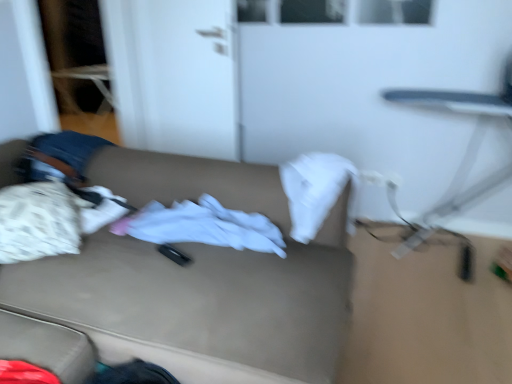
Locate an element on the screen. The image size is (512, 384). vacant area situated below metallic silver swivel chair at right (from a real-world perspective) is located at coordinates (446, 258).